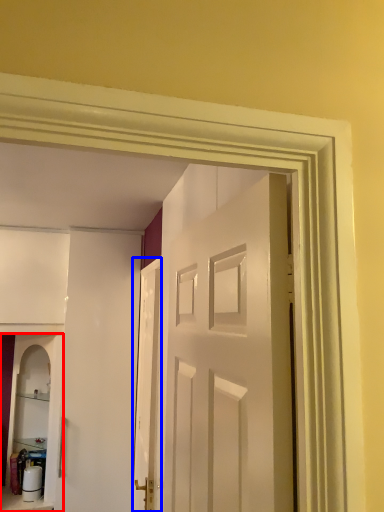
Question: Which object appears closest to the camera in this image, cabinetry (highlighted by a red box) or door (highlighted by a blue box)?

Choices:
 (A) cabinetry
 (B) door

Answer: (B)